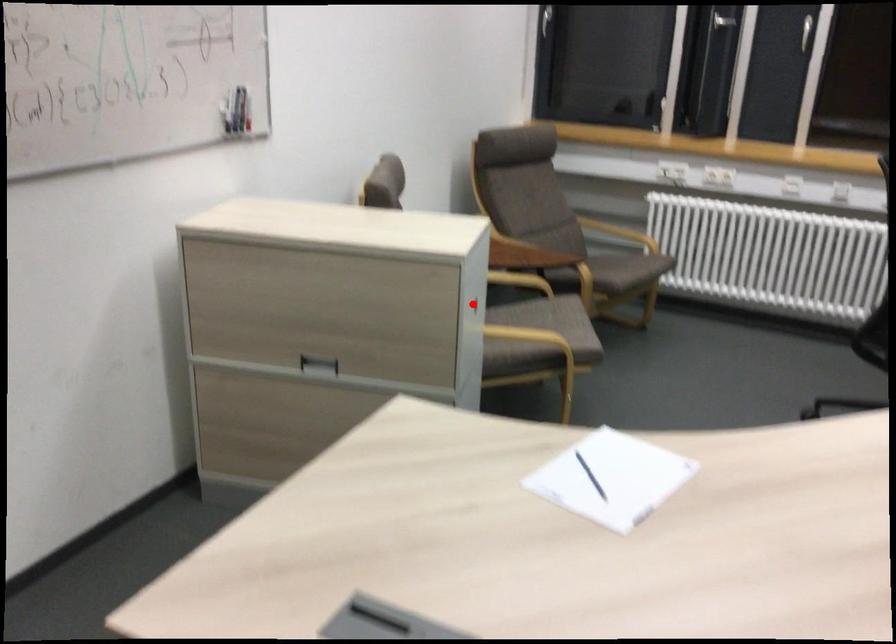
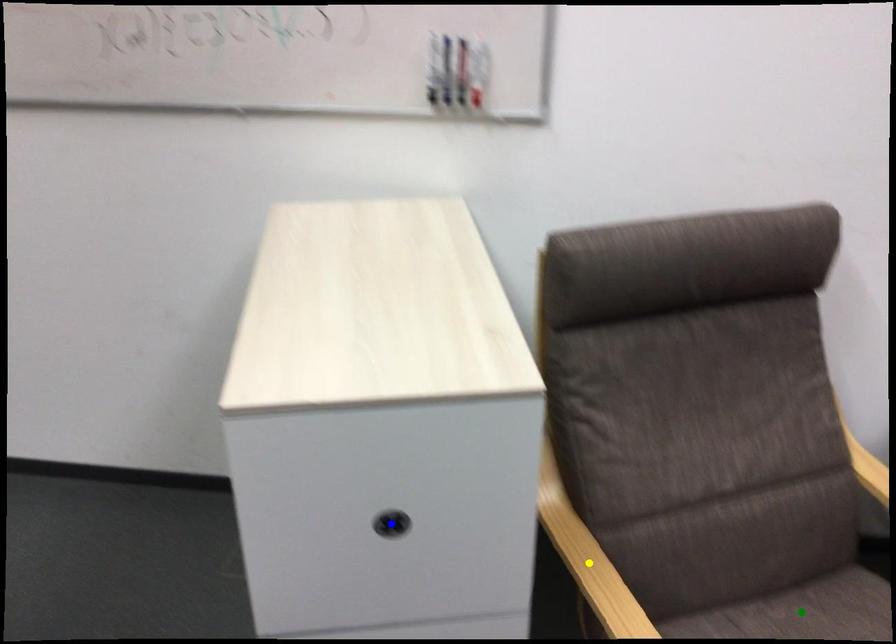
Question: I am providing you with two images of the same scene from different viewpoints. A red point is marked on the first image. You are given multiple points on the second image. In image 2, which mark is for the same physical point as the one in image 1?

Choices:
 (A) yellow point
 (B) green point
 (C) blue point

Answer: (C)